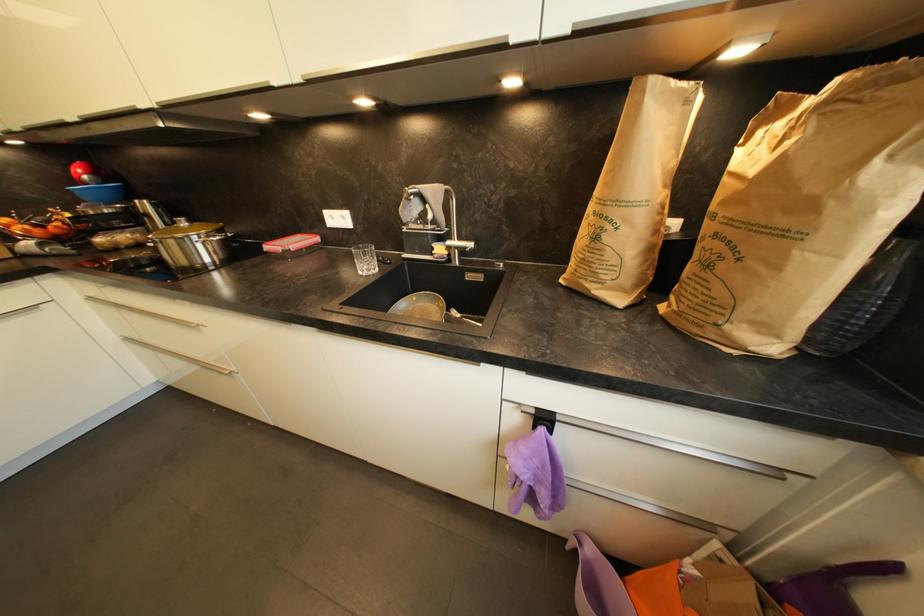
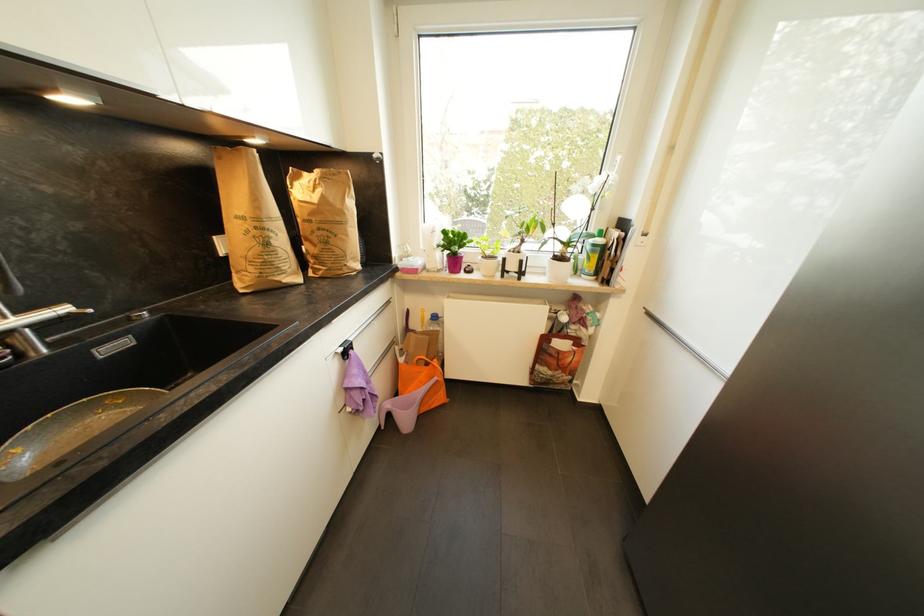
Locate, in the second image, the point that corresponds to point 601,240 in the first image.

(272, 246)